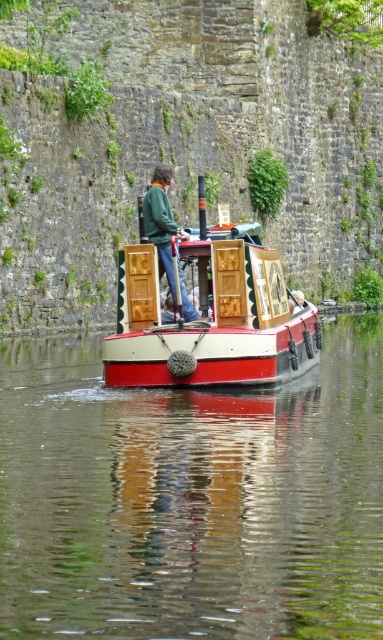
Question: Does smooth glossy water at center come behind green matte jacket at center?

Choices:
 (A) yes
 (B) no

Answer: (B)

Question: Which point is farther to the camera?

Choices:
 (A) green matte jacket at center
 (B) wooden cabin cruiser at center
 (C) smooth glossy water at center

Answer: (A)

Question: Which is farther from the green matte jacket at center?

Choices:
 (A) smooth glossy water at center
 (B) wooden cabin cruiser at center

Answer: (A)

Question: Is smooth glossy water at center behind wooden cabin cruiser at center?

Choices:
 (A) yes
 (B) no

Answer: (B)

Question: Which of these objects is positioned closest to the wooden cabin cruiser at center?

Choices:
 (A) smooth glossy water at center
 (B) green matte jacket at center

Answer: (B)

Question: Is smooth glossy water at center below wooden cabin cruiser at center?

Choices:
 (A) yes
 (B) no

Answer: (A)